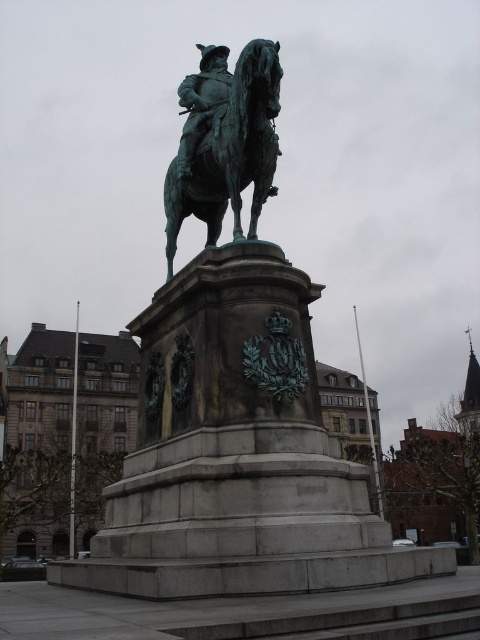
Question: Is bronze statue at center to the right of polished bronze rider at center from the viewer's perspective?

Choices:
 (A) yes
 (B) no

Answer: (A)

Question: Which of the following is the closest to the observer?

Choices:
 (A) (218, 80)
 (B) (236, 120)

Answer: (B)

Question: Which point appears closest to the camera in this image?

Choices:
 (A) (184, 106)
 (B) (277, 93)

Answer: (B)

Question: Does bronze statue at center appear on the right side of polished bronze rider at center?

Choices:
 (A) no
 (B) yes

Answer: (B)

Question: Does bronze statue at center lie behind polished bronze rider at center?

Choices:
 (A) no
 (B) yes

Answer: (A)